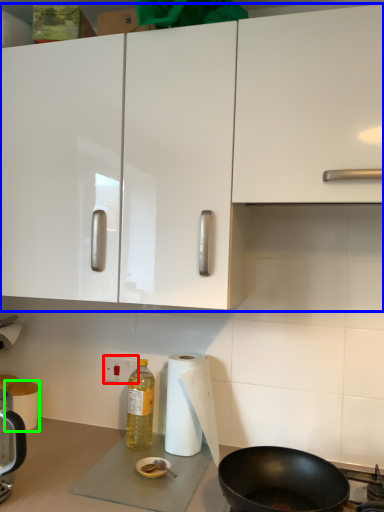
Question: Based on their relative distances, which object is farther from electric outlet (highlighted by a red box)? Choose from cabinetry (highlighted by a blue box) and paper towel (highlighted by a green box).

Choices:
 (A) cabinetry
 (B) paper towel

Answer: (A)